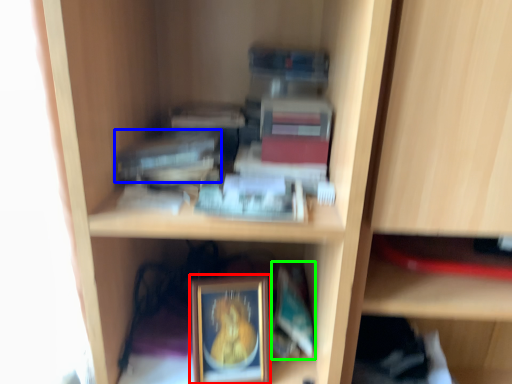
Question: Which object is positioned farthest from picture frame (highlighted by a red box)? Select from paperback book (highlighted by a blue box) and paperback book (highlighted by a green box).

Choices:
 (A) paperback book
 (B) paperback book

Answer: (A)